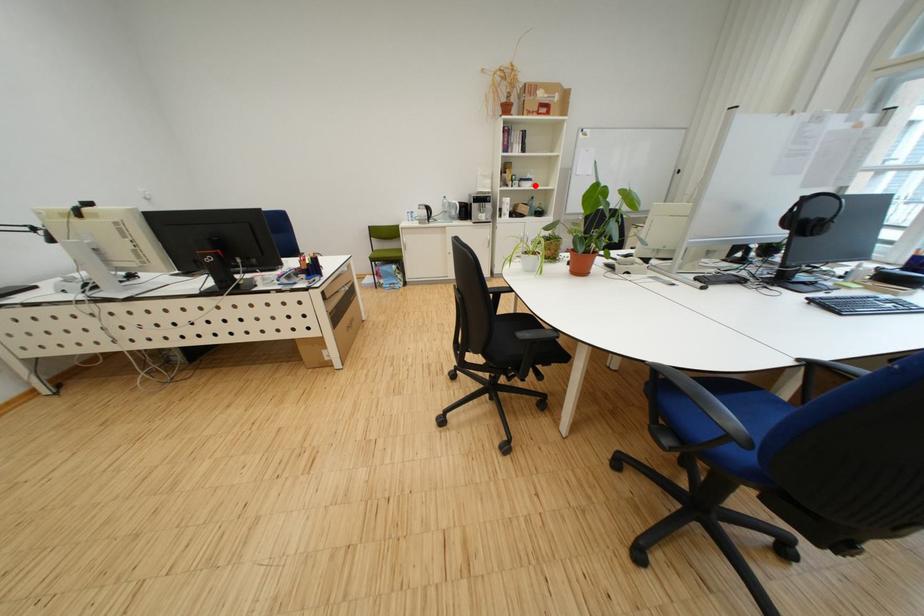
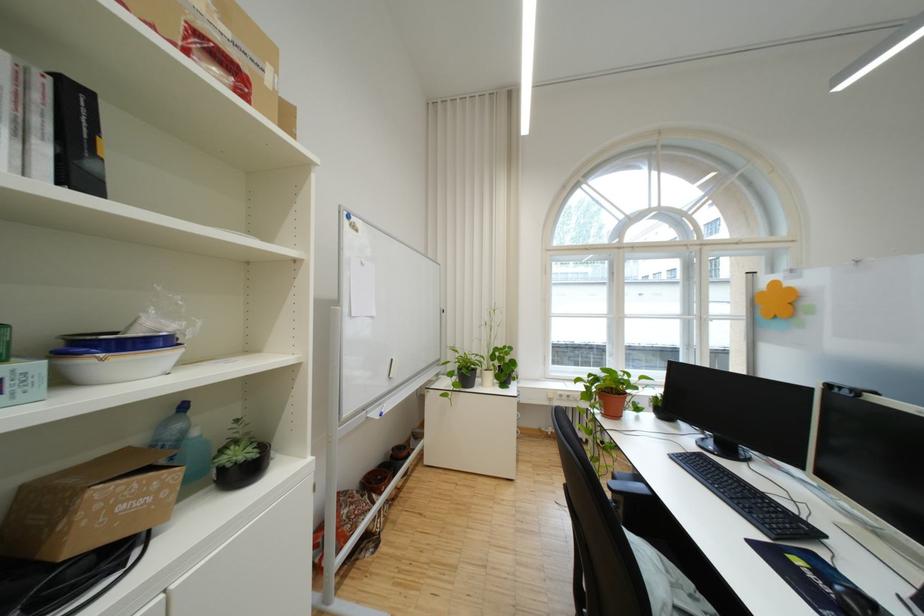
Question: I am providing you with two images of the same scene from different viewpoints. In image1, a red point is highlighted. Considering the same 3D point in image2, which of the following is correct?

Choices:
 (A) It is closer
 (B) It is farther

Answer: (B)